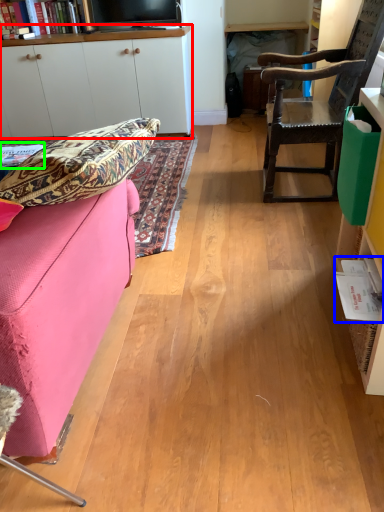
Question: Considering the real-world distances, which object is farthest from cabinetry (highlighted by a red box)? book (highlighted by a blue box) or book (highlighted by a green box)?

Choices:
 (A) book
 (B) book

Answer: (A)